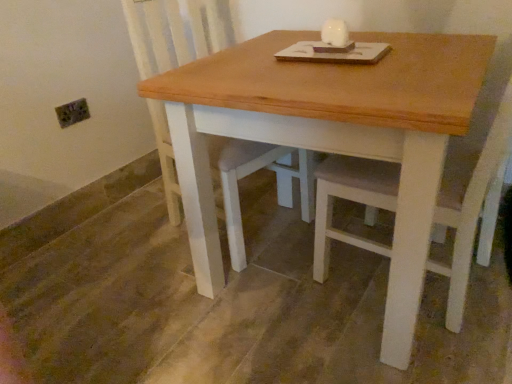
The width and height of the screenshot is (512, 384). Describe the element at coordinates (330, 136) in the screenshot. I see `wooden table at center` at that location.

The image size is (512, 384). Identify the location of wooden table at center. (330, 136).

In order to face wooden table at center, should I rotate leftwards or rightwards?

Rotate right and turn 10.064 degrees.

Where is `wooden swivel chair at center`? wooden swivel chair at center is located at coordinates (172, 32).

What do you see at coordinates (172, 32) in the screenshot?
I see `wooden swivel chair at center` at bounding box center [172, 32].

Identify the location of wooden table at center. pos(330,136).

Is wooden table at center to the right of wooden swivel chair at center from the viewer's perspective?

Indeed, wooden table at center is positioned on the right side of wooden swivel chair at center.

Is the position of wooden table at center less distant than that of wooden swivel chair at center?

Yes, wooden table at center is closer to the viewer.

Between point (399, 282) and point (132, 13), which one is positioned in front?

Positioned in front is point (399, 282).

From the image's perspective, which is above, wooden table at center or wooden swivel chair at center?

wooden swivel chair at center appears higher in the image.

In the scene shown: From a real-world perspective, which is physically below, wooden table at center or wooden swivel chair at center?

wooden table at center.

Considering the relative sizes of wooden table at center and wooden swivel chair at center in the image provided, is wooden table at center thinner than wooden swivel chair at center?

Incorrect, the width of wooden table at center is not less than that of wooden swivel chair at center.

Consider the image. Considering the sizes of objects wooden table at center and wooden swivel chair at center in the image provided, who is taller, wooden table at center or wooden swivel chair at center?

wooden swivel chair at center is taller.

Who is bigger, wooden table at center or wooden swivel chair at center?

With larger size is wooden table at center.

Would you say wooden table at center is inside or outside wooden swivel chair at center?

wooden table at center is spatially situated outside wooden swivel chair at center.

Are wooden table at center and wooden swivel chair at center beside each other?

No, wooden table at center is not making contact with wooden swivel chair at center.

Is wooden table at center looking in the opposite direction of wooden swivel chair at center?

Yes, wooden table at center's orientation is away from wooden swivel chair at center.

How much distance is there between wooden table at center and wooden swivel chair at center?

The distance of wooden table at center from wooden swivel chair at center is 24.27 inches.

This screenshot has width=512, height=384. Identify the location of swivel chair that appears behind the wooden table at center. (172, 32).

Between wooden swivel chair at center and wooden table at center, which one appears on the left side from the viewer's perspective?

From the viewer's perspective, wooden swivel chair at center appears more on the left side.

From the picture: Which object is closer to the camera, wooden swivel chair at center or wooden table at center?

wooden table at center is more forward.

Which point is more distant from viewer, (282, 159) or (321, 124)?

Point (282, 159)

Looking at this image, from the image's perspective, is wooden swivel chair at center beneath wooden table at center?

Actually, wooden swivel chair at center appears above wooden table at center in the image.

From a real-world perspective, between wooden swivel chair at center and wooden table at center, who is vertically higher?

From a 3D spatial view, wooden swivel chair at center is above.

Does wooden swivel chair at center have a greater width compared to wooden table at center?

In fact, wooden swivel chair at center might be narrower than wooden table at center.

Considering the relative sizes of wooden swivel chair at center and wooden table at center in the image provided, is wooden swivel chair at center taller than wooden table at center?

Yes.

Is wooden swivel chair at center bigger than wooden table at center?

Actually, wooden swivel chair at center might be smaller than wooden table at center.

Does wooden swivel chair at center contain wooden table at center?

That's incorrect, wooden table at center is not inside wooden swivel chair at center.

Is wooden swivel chair at center positioned far away from wooden table at center?

No, wooden swivel chair at center is not far away from wooden table at center.

Is wooden swivel chair at center oriented away from wooden table at center?

No, wooden swivel chair at center is not facing the opposite direction of wooden table at center.

Where is `table below the wooden swivel chair at center (from the image's perspective)`? Image resolution: width=512 pixels, height=384 pixels. table below the wooden swivel chair at center (from the image's perspective) is located at coordinates (330, 136).

In the image, there is a wooden table at center. Identify the location of swivel chair above it (from the image's perspective). (172, 32).

You are a GUI agent. You are given a task and a screenshot of the screen. Output one action in this format:
    pyautogui.click(x=<x>, y=<y>)
    Task: Click on the table below the wooden swivel chair at center (from a real-world perspective)
    Image resolution: width=512 pixels, height=384 pixels.
    Given the screenshot: What is the action you would take?
    pyautogui.click(x=330, y=136)